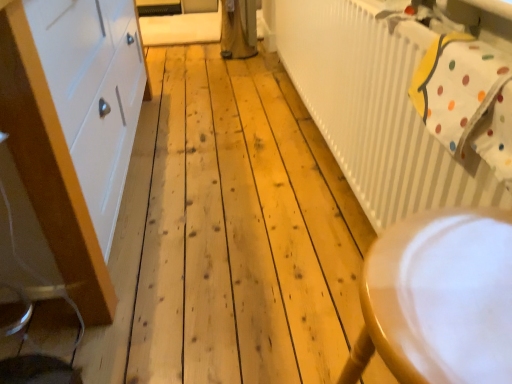
Identify the location of vacant space underneath white ribbed radiator at upper right (from a real-world perspective). The height and width of the screenshot is (384, 512). (326, 167).